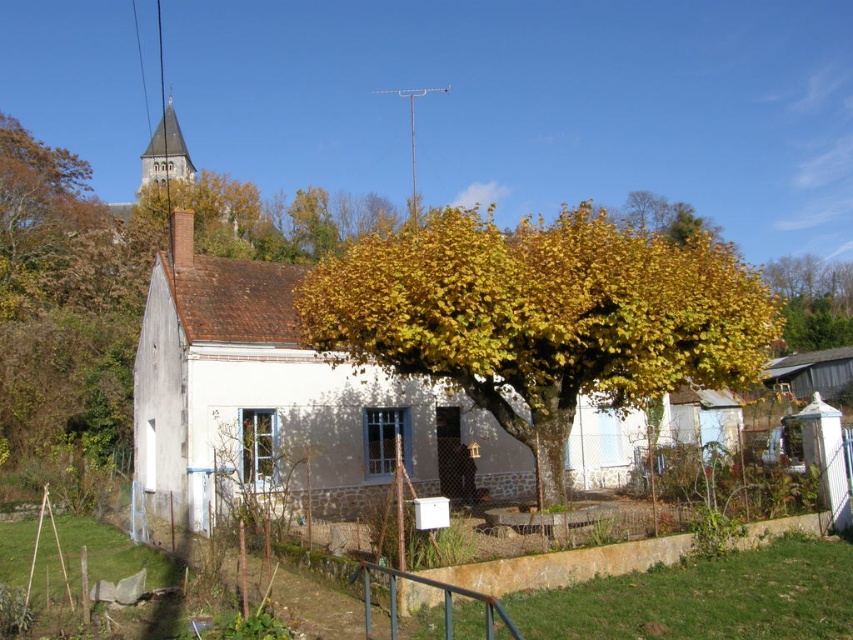
You are a painter standing at the edge of the grassy area in front of the house. You want to paint the entire white stone cottage at center without the golden leafy tree at center blocking your view. Is this possible?

The golden leafy tree at center is taller than the white stone cottage at center, so the tree will block the view of the cottage. Therefore, it is not possible to paint the entire cottage without the tree blocking part of it.